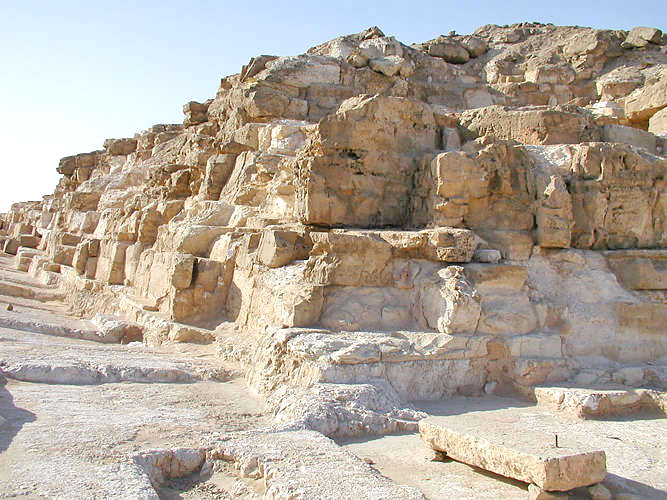
Locate an element on the screen. This screenshot has height=500, width=667. lintel is located at coordinates (476, 445).